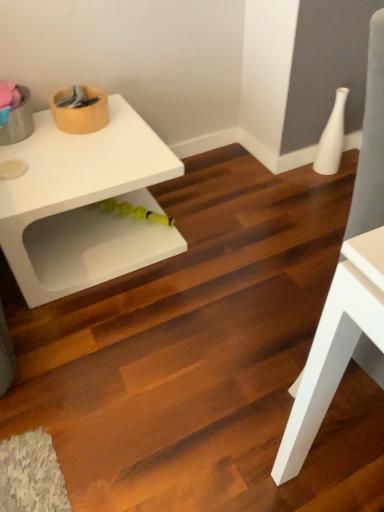
Where is `vacant space that's between white matte table at right, which is counted as the second table, starting from the left, and white matte table at upper left, positioned as the 1th table in back-to-front order`? The height and width of the screenshot is (512, 384). vacant space that's between white matte table at right, which is counted as the second table, starting from the left, and white matte table at upper left, positioned as the 1th table in back-to-front order is located at coordinates (198, 318).